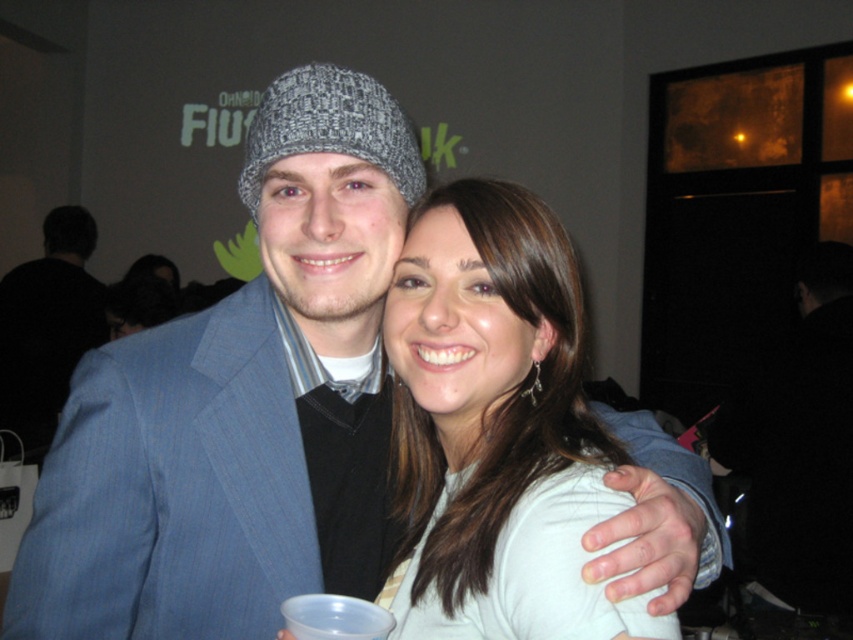
Is black fabric jacket at right taller than matte gray beanie at left?

Incorrect, black fabric jacket at right's height is not larger of matte gray beanie at left's.

Between black fabric jacket at right and matte gray beanie at left, which one has more height?

With more height is matte gray beanie at left.

Is point (842, 362) positioned after point (57, 360)?

No, (842, 362) is closer to viewer.

The width and height of the screenshot is (853, 640). I want to click on black fabric jacket at right, so click(799, 444).

Can you confirm if white matte shirt at center is wider than black fabric jacket at right?

No, white matte shirt at center is not wider than black fabric jacket at right.

What do you see at coordinates (482, 378) in the screenshot? The image size is (853, 640). I see `white matte shirt at center` at bounding box center [482, 378].

You are a GUI agent. You are given a task and a screenshot of the screen. Output one action in this format:
    pyautogui.click(x=<x>, y=<y>)
    Task: Click on the white matte shirt at center
    The width and height of the screenshot is (853, 640).
    Given the screenshot: What is the action you would take?
    pyautogui.click(x=482, y=378)

Is white matte shirt at center to the left of matte gray beanie at left from the viewer's perspective?

Incorrect, white matte shirt at center is not on the left side of matte gray beanie at left.

Does white matte shirt at center have a greater height compared to matte gray beanie at left?

No.

Is point (405, 301) closer to camera compared to point (15, 330)?

Yes, it is.

The width and height of the screenshot is (853, 640). What are the coordinates of `white matte shirt at center` in the screenshot? It's located at (482, 378).